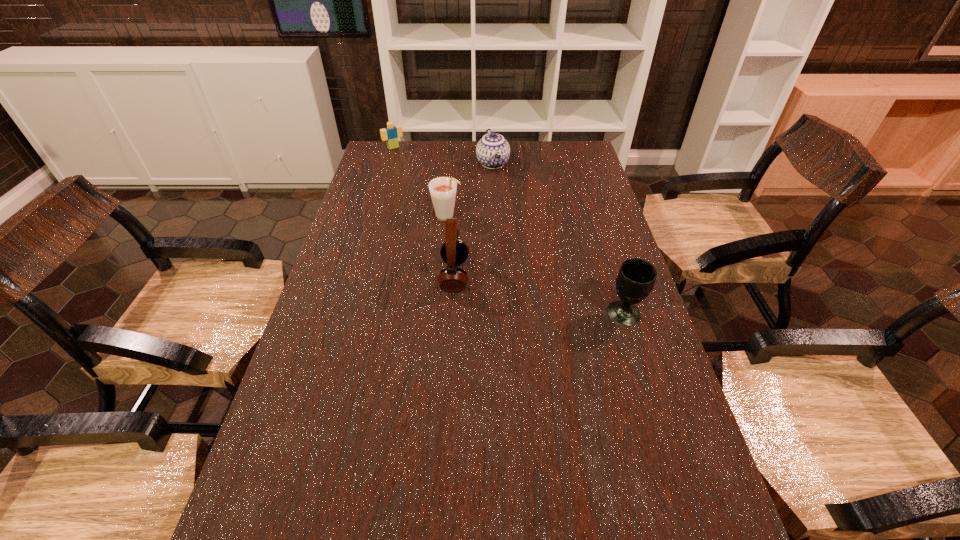
The image size is (960, 540). I want to click on the second nearest object, so click(x=454, y=251).

Find the location of a particular element. the rightmost object is located at coordinates (636, 277).

Identify the location of the nearest object. Image resolution: width=960 pixels, height=540 pixels. (636, 277).

At what (x,y) coordinates should I click in order to perform the action: click on the fourth object from left to right. Please return your answer as a coordinate pair (x, y). Looking at the image, I should click on (493, 151).

Identify the location of the second shortest object. (493, 151).

Locate an element on the screen. This screenshot has width=960, height=540. root beer is located at coordinates (442, 189).

You are a GUI agent. You are given a task and a screenshot of the screen. Output one action in this format:
    pyautogui.click(x=<x>, y=<y>)
    Task: Click on the shortest object
    The height and width of the screenshot is (540, 960).
    Given the screenshot: What is the action you would take?
    pyautogui.click(x=391, y=133)

The height and width of the screenshot is (540, 960). I want to click on the leftmost object, so click(x=391, y=133).

Find the location of a particular element. This screenshot has width=960, height=540. vacant region located 0.180m on the ear pads of the second nearest object is located at coordinates (378, 276).

Identify the location of free spot located 0.220m on the ear pads of the second nearest object. This screenshot has width=960, height=540. (365, 276).